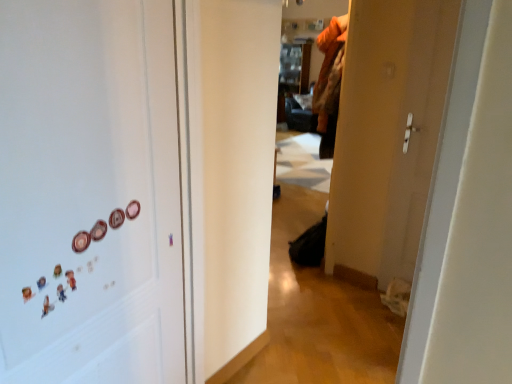
Question: Should I look upward or downward to see pink glossy button at left, which is the 1th button in left-to-right order?

Choices:
 (A) up
 (B) down

Answer: (B)

Question: From a real-world perspective, is matte plastic button at left, placed as the 1th button when sorted from right to left, over pink glossy button at left, which is the 1th button in left-to-right order?

Choices:
 (A) no
 (B) yes

Answer: (B)

Question: From the image's perspective, is matte plastic button at left, which is the second button in left-to-right order, under pink glossy button at left, the 2th button viewed from the back?

Choices:
 (A) yes
 (B) no

Answer: (B)

Question: From the image's perspective, does matte plastic button at left, which is the second button in left-to-right order, appear higher than pink glossy button at left, which is the 1th button in left-to-right order?

Choices:
 (A) yes
 (B) no

Answer: (A)

Question: Does matte plastic button at left, placed as the 1th button when sorted from right to left, have a greater width compared to pink glossy button at left, the 2th button viewed from the back?

Choices:
 (A) no
 (B) yes

Answer: (B)

Question: Does matte plastic button at left, which is the second button in left-to-right order, turn towards pink glossy button at left, the 2th button viewed from the back?

Choices:
 (A) yes
 (B) no

Answer: (B)

Question: Is pink glossy button at left, the 2th button viewed from the back, located within matte plastic button at left, which is the first button in back-to-front order?

Choices:
 (A) no
 (B) yes

Answer: (A)

Question: Is white matte magnets at left facing away from matte plastic button at left, which is the first button in back-to-front order?

Choices:
 (A) yes
 (B) no

Answer: (A)

Question: Can you confirm if white matte magnets at left is shorter than matte plastic button at left, which is the 2th button in front-to-back order?

Choices:
 (A) yes
 (B) no

Answer: (B)

Question: Does white matte magnets at left have a greater height compared to matte plastic button at left, which is the 2th button in front-to-back order?

Choices:
 (A) yes
 (B) no

Answer: (A)

Question: Is white matte magnets at left closer to camera compared to matte plastic button at left, which is the second button in left-to-right order?

Choices:
 (A) yes
 (B) no

Answer: (A)

Question: From a real-world perspective, is white matte magnets at left positioned under matte plastic button at left, which is the 2th button in front-to-back order, based on gravity?

Choices:
 (A) yes
 (B) no

Answer: (A)

Question: Does white matte magnets at left have a greater width compared to matte plastic button at left, which is the first button in back-to-front order?

Choices:
 (A) no
 (B) yes

Answer: (B)

Question: Can you confirm if matte plastic button at left, which is the 2th button in front-to-back order, is taller than white matte magnets at left?

Choices:
 (A) no
 (B) yes

Answer: (A)